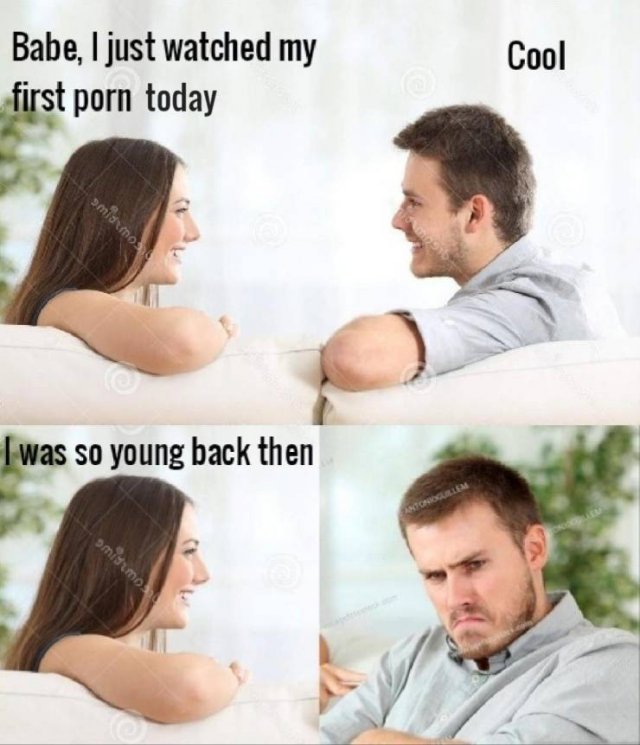
This screenshot has width=640, height=745. In order to click on 3 couches in this screenshot , I will do `click(32, 710)`, `click(36, 399)`, `click(593, 386)`.